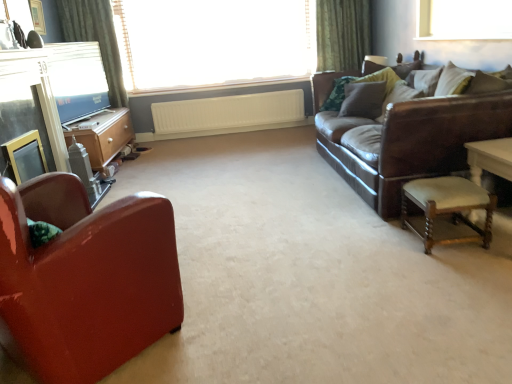
Question: Considering the relative sizes of velvet brown pillow at upper right, which ranks as the first pillow in right-to-left order, and leather couch at right in the image provided, is velvet brown pillow at upper right, which ranks as the first pillow in right-to-left order, taller than leather couch at right?

Choices:
 (A) no
 (B) yes

Answer: (A)

Question: Is velvet brown pillow at upper right, acting as the second pillow starting from the left, outside leather couch at right?

Choices:
 (A) yes
 (B) no

Answer: (B)

Question: Is velvet brown pillow at upper right, which ranks as the first pillow in right-to-left order, in front of leather couch at right?

Choices:
 (A) no
 (B) yes

Answer: (A)

Question: From the image's perspective, is velvet brown pillow at upper right, which ranks as the first pillow in right-to-left order, located beneath leather couch at right?

Choices:
 (A) no
 (B) yes

Answer: (A)

Question: Considering the relative sizes of velvet brown pillow at upper right, acting as the second pillow starting from the left, and leather couch at right in the image provided, is velvet brown pillow at upper right, acting as the second pillow starting from the left, smaller than leather couch at right?

Choices:
 (A) yes
 (B) no

Answer: (A)

Question: Would you say velvet brown pillow at upper right, acting as the second pillow starting from the left, is to the left or to the right of wooden upholstered stool at right in the picture?

Choices:
 (A) left
 (B) right

Answer: (B)

Question: Is velvet brown pillow at upper right, which ranks as the first pillow in right-to-left order, bigger or smaller than wooden upholstered stool at right?

Choices:
 (A) big
 (B) small

Answer: (B)

Question: Considering the positions of velvet brown pillow at upper right, which ranks as the first pillow in right-to-left order, and wooden upholstered stool at right in the image, is velvet brown pillow at upper right, which ranks as the first pillow in right-to-left order, wider or thinner than wooden upholstered stool at right?

Choices:
 (A) wide
 (B) thin

Answer: (B)

Question: Is velvet brown pillow at upper right, acting as the second pillow starting from the left, inside the boundaries of wooden upholstered stool at right, or outside?

Choices:
 (A) inside
 (B) outside

Answer: (B)

Question: Is point (353, 115) positioned closer to the camera than point (467, 187)?

Choices:
 (A) closer
 (B) farther

Answer: (B)

Question: Looking at their shapes, would you say velvet brown pillow at upper right, the 1th pillow in the left-to-right sequence, is wider or thinner than wooden upholstered stool at right?

Choices:
 (A) thin
 (B) wide

Answer: (A)

Question: From a real-world perspective, relative to wooden upholstered stool at right, is velvet brown pillow at upper right, the 1th pillow in the left-to-right sequence, vertically above or below?

Choices:
 (A) above
 (B) below

Answer: (A)

Question: Considering the positions of velvet brown pillow at upper right, the 1th pillow in the left-to-right sequence, and wooden upholstered stool at right in the image, is velvet brown pillow at upper right, the 1th pillow in the left-to-right sequence, bigger or smaller than wooden upholstered stool at right?

Choices:
 (A) small
 (B) big

Answer: (B)

Question: Looking at the image, does green fabric curtain at upper left seem bigger or smaller compared to wooden dresser at left?

Choices:
 (A) big
 (B) small

Answer: (B)

Question: From the image's perspective, is green fabric curtain at upper left above or below wooden dresser at left?

Choices:
 (A) below
 (B) above

Answer: (B)